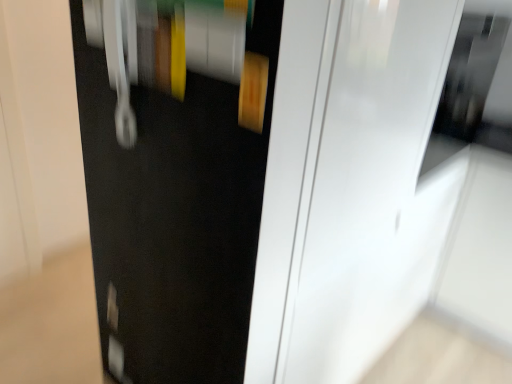
Question: Should I look upward or downward to see white glossy screen door at center?

Choices:
 (A) down
 (B) up

Answer: (B)